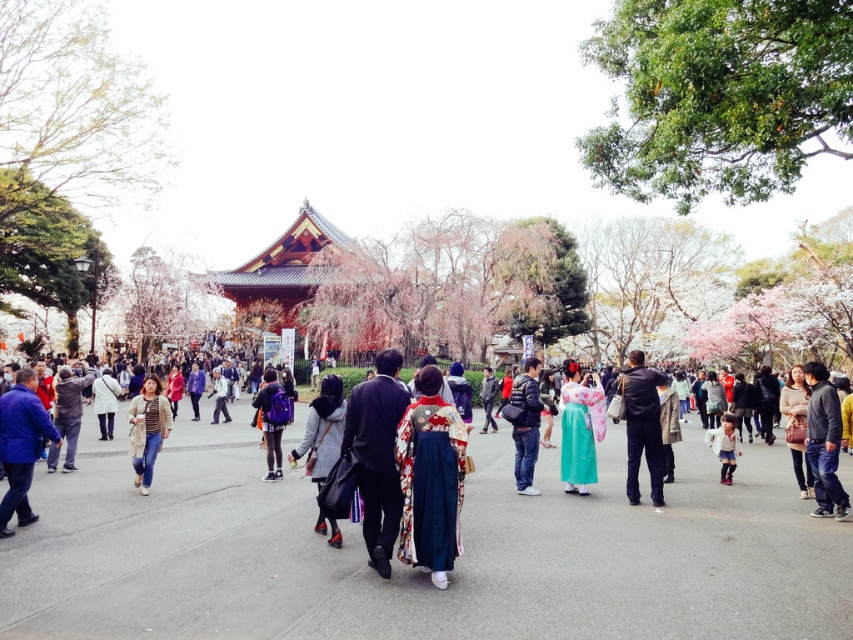
Question: Does dark blue suit at center have a greater width compared to matte purple backpack at center?

Choices:
 (A) no
 (B) yes

Answer: (A)

Question: Among these points, which one is nearest to the camera?

Choices:
 (A) (680, 579)
 (B) (160, 412)
 (C) (728, 481)

Answer: (A)

Question: Can you confirm if dark blue fabric pants at center is smaller than dark blue jeans at center?

Choices:
 (A) no
 (B) yes

Answer: (A)

Question: Estimate the real-world distances between objects in this image. Which object is farther from the dark blue fabric pants at center?

Choices:
 (A) dark blue suit at center
 (B) dark blue jeans at center
 (C) silky green kimono at center

Answer: (A)

Question: Estimate the real-world distances between objects in this image. Which object is farther from the dark blue fabric pants at center?

Choices:
 (A) blue matte jacket at left
 (B) light brown leather jacket at center

Answer: (B)

Question: Is silk kimono at center thinner than matte purple backpack at center?

Choices:
 (A) yes
 (B) no

Answer: (A)